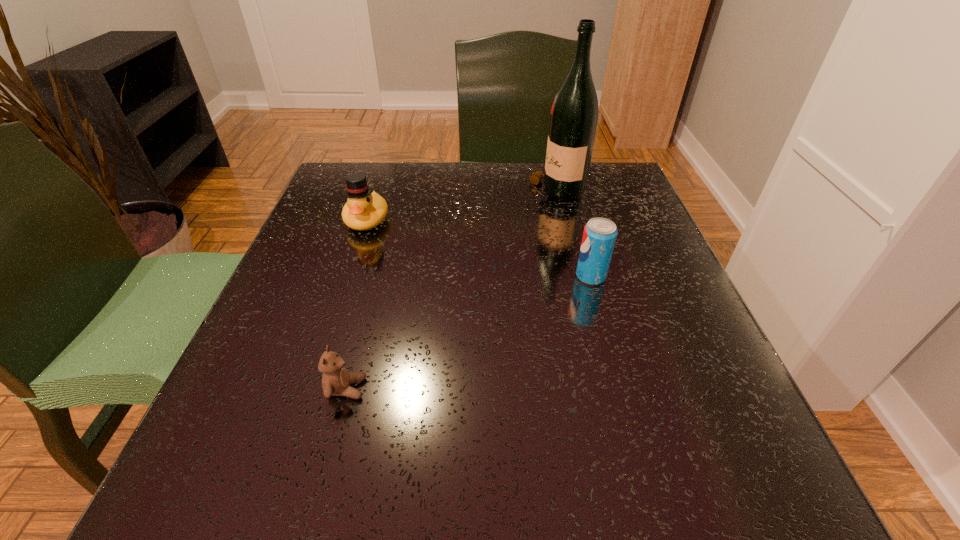
Identify the location of free space between the third farthest object and the duck. This screenshot has height=540, width=960. (479, 248).

Image resolution: width=960 pixels, height=540 pixels. Identify the location of vacant area that lies between the shortest object and the duck. (357, 304).

Identify the location of free space between the nearest object and the duck. (357, 304).

Identify the location of vacant space that is in between the soda can and the wine bottle. This screenshot has width=960, height=540. (573, 234).

Locate an element on the screen. object that can be found as the closest to the wine bottle is located at coordinates (599, 236).

Point out which object is positioned as the second nearest to the duck. Please provide its 2D coordinates. Your answer should be formatted as a tuple, i.e. [(x, y)], where the tuple contains the x and y coordinates of a point satisfying the conditions above.

[(336, 380)]

At what (x,y) coordinates should I click in order to perform the action: click on free space that satisfies the following two spatial constraints: 1. on the back side of the soda can; 2. on the surface of the tallest object. Please return your answer as a coordinate pair (x, y). Image resolution: width=960 pixels, height=540 pixels. Looking at the image, I should click on (567, 192).

In order to click on free space that satisfies the following two spatial constraints: 1. on the front-facing side of the duck; 2. on the left side of the soda can in this screenshot , I will do `click(348, 276)`.

The image size is (960, 540). In order to click on vacant point that satisfies the following two spatial constraints: 1. on the surface of the tallest object; 2. on the right side of the third farthest object in this screenshot , I will do `click(575, 276)`.

Where is `free point that satisfies the following two spatial constraints: 1. on the front side of the soda can; 2. on the front-facing side of the shortest object`? The height and width of the screenshot is (540, 960). free point that satisfies the following two spatial constraints: 1. on the front side of the soda can; 2. on the front-facing side of the shortest object is located at coordinates (622, 388).